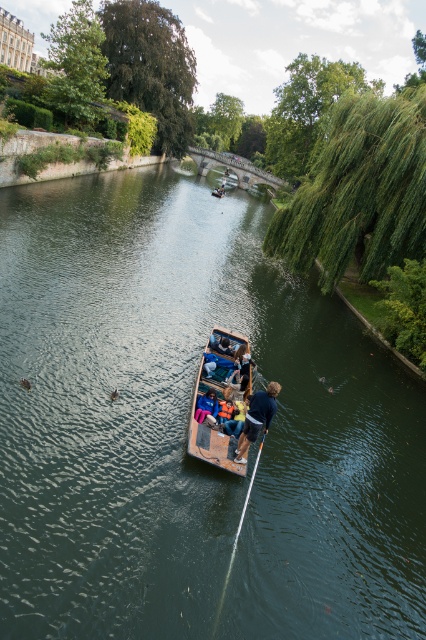
Is point (250, 404) farther from camera compared to point (241, 518)?

Yes, it is.

Is blue fabric jacket at center bigger than white plastic paddle at center?

Correct, blue fabric jacket at center is larger in size than white plastic paddle at center.

Which is behind, point (236, 461) or point (219, 602)?

The point (236, 461) is more distant.

Identify the location of blue fabric jacket at center. (256, 417).

Is blue fabric jacket at center bigger than blue denim jacket at center?

Yes, blue fabric jacket at center is bigger than blue denim jacket at center.

Is point (259, 412) less distant than point (213, 422)?

Yes, it is.

The image size is (426, 640). I want to click on blue fabric jacket at center, so click(256, 417).

Who is taller, wooden boat at center or white plastic paddle at center?

wooden boat at center

Which is more to the right, wooden boat at center or white plastic paddle at center?

Positioned to the right is white plastic paddle at center.

Is point (204, 426) in front of point (218, 602)?

No.

Locate an element on the screen. The height and width of the screenshot is (640, 426). wooden boat at center is located at coordinates (207, 417).